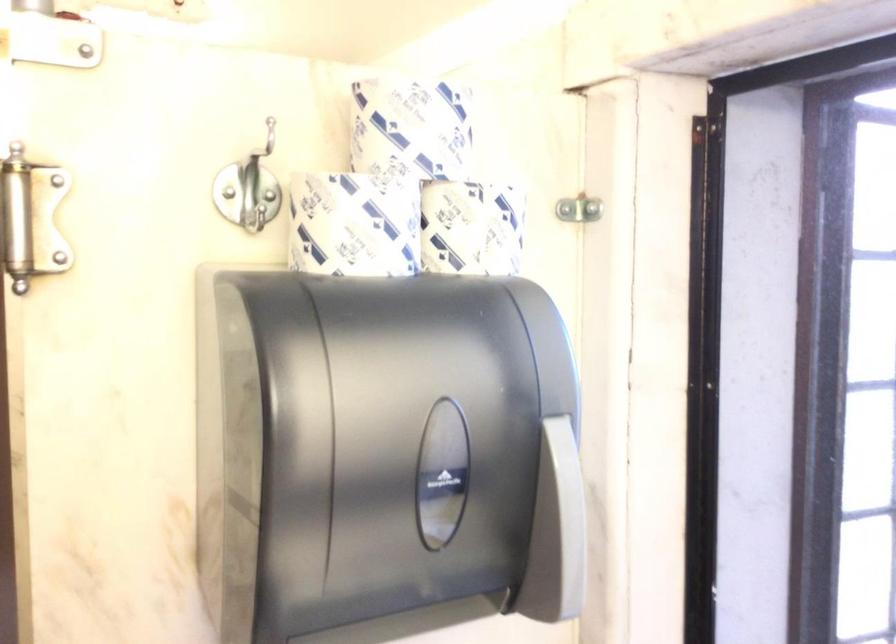
Find where to push the gray dispenser lever. Please return your answer as a coordinate pair (x, y).

(557, 532)